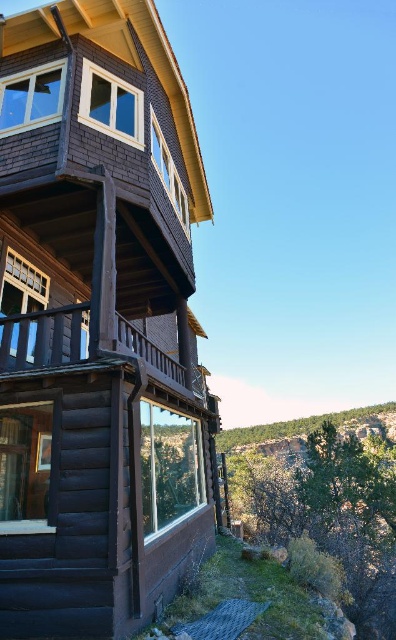
Is dark brown wood cabin at left taller than green mossy rock at lower right?

Correct, dark brown wood cabin at left is much taller as green mossy rock at lower right.

Can you confirm if dark brown wood cabin at left is wider than green mossy rock at lower right?

In fact, dark brown wood cabin at left might be narrower than green mossy rock at lower right.

Who is more forward, (74, 173) or (336, 419)?

Point (74, 173) is in front.

You are a GUI agent. You are given a task and a screenshot of the screen. Output one action in this format:
    pyautogui.click(x=<x>, y=<y>)
    Task: Click on the dark brown wood cabin at left
    The width and height of the screenshot is (396, 640).
    Given the screenshot: What is the action you would take?
    pyautogui.click(x=97, y=323)

Consider the image. Is dark brown wood cabin at left below brown wooden balcony at upper left?

No, dark brown wood cabin at left is not below brown wooden balcony at upper left.

Between point (144, 492) and point (51, 332), which one is positioned in front?

Positioned in front is point (144, 492).

Locate an element on the screen. Image resolution: width=396 pixels, height=640 pixels. dark brown wood cabin at left is located at coordinates (97, 323).

Between point (163, 384) and point (249, 428), which one is positioned in front?

Positioned in front is point (163, 384).

Can you confirm if brown wooden balcony at upper left is positioned above green mossy rock at lower right?

Yes, brown wooden balcony at upper left is above green mossy rock at lower right.

Locate an element on the screen. Image resolution: width=396 pixels, height=640 pixels. brown wooden balcony at upper left is located at coordinates (45, 339).